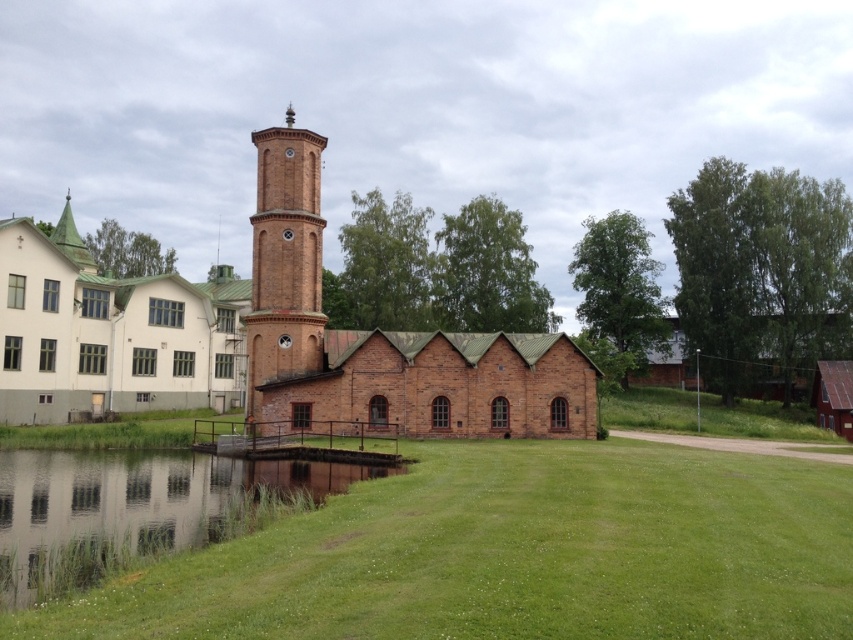
Which is below, white painted wood church at left or red brick bell tower at center?

Positioned lower is red brick bell tower at center.

Who is more forward, [207,291] or [318,228]?

Point [318,228] is more forward.

You are a GUI agent. You are given a task and a screenshot of the screen. Output one action in this format:
    pyautogui.click(x=<x>, y=<y>)
    Task: Click on the white painted wood church at left
    
    Given the screenshot: What is the action you would take?
    pyautogui.click(x=109, y=332)

Locate an element on the screen. white painted wood church at left is located at coordinates (109, 332).

Between brick building at center and green grass at lower left, which one has less height?

Standing shorter between the two is green grass at lower left.

Does brick building at center have a larger size compared to green grass at lower left?

Indeed, brick building at center has a larger size compared to green grass at lower left.

Is point (289, 141) closer to camera compared to point (22, 552)?

No.

Locate an element on the screen. brick building at center is located at coordinates (383, 339).

Which is below, green grass at lower left or red brick bell tower at center?

green grass at lower left is below.

Does point (154, 522) come closer to viewer compared to point (312, 140)?

Yes, it is in front of point (312, 140).

Find the location of `green grass at lower left`. green grass at lower left is located at coordinates (136, 508).